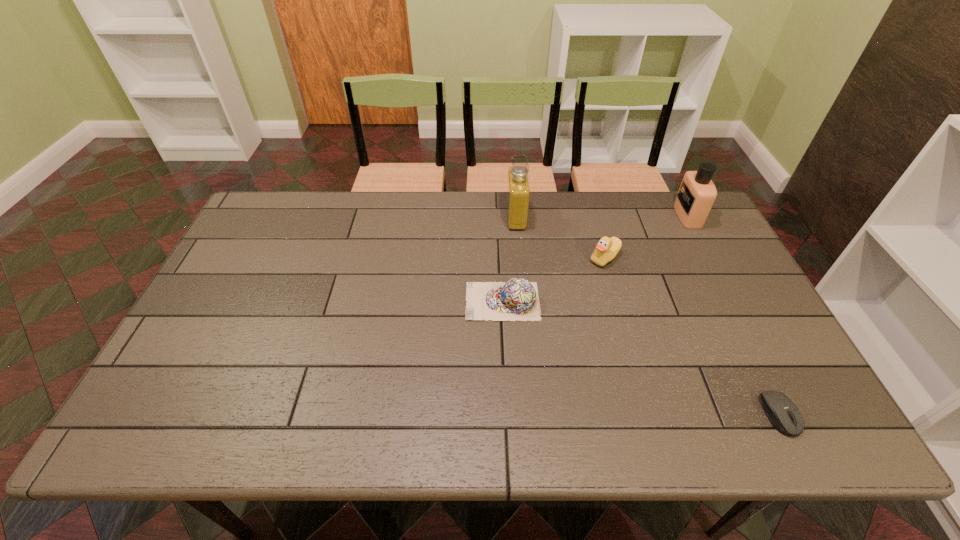
At what (x,y) coordinates should I click in order to perform the action: click on free space located on the front-facing side of the left perfume. Please return your answer as a coordinate pair (x, y). Looking at the image, I should click on (402, 218).

Locate an element on the screen. The height and width of the screenshot is (540, 960). free location located on the front label of the right perfume is located at coordinates (567, 216).

This screenshot has width=960, height=540. I want to click on free region located 0.330m on the front label of the right perfume, so click(x=579, y=216).

I want to click on free space located on the front label of the right perfume, so click(x=627, y=216).

This screenshot has height=540, width=960. I want to click on free location located 0.380m at the beak of the third object from left to right, so click(x=464, y=258).

The height and width of the screenshot is (540, 960). Identify the location of vacant point located 0.320m at the beak of the third object from left to right. (483, 258).

You are a GUI agent. You are given a task and a screenshot of the screen. Output one action in this format:
    pyautogui.click(x=<x>, y=<y>)
    Task: Click on the vacant region located 0.210m at the beak of the third object from left to right
    The height and width of the screenshot is (540, 960).
    Given the screenshot: What is the action you would take?
    pyautogui.click(x=519, y=258)

Image resolution: width=960 pixels, height=540 pixels. I want to click on vacant region located on the front, side, and top of the cap, so click(x=343, y=301).

Find the location of a particular element. This screenshot has height=540, width=960. vacant space located on the front, side, and top of the cap is located at coordinates (328, 301).

Find the location of a particular element. vacant position located 0.370m on the front, side, and top of the cap is located at coordinates (331, 301).